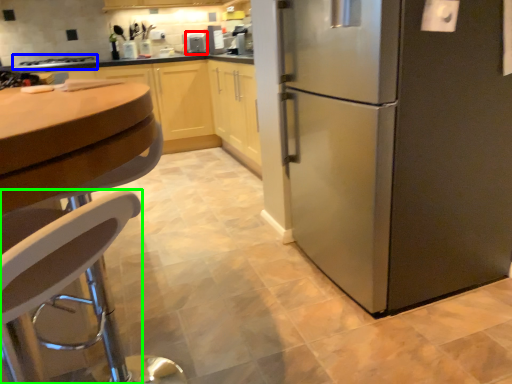
Question: Which is nearer to the appliance (highlighted by a red box)? stove (highlighted by a blue box) or chair (highlighted by a green box).

Choices:
 (A) stove
 (B) chair

Answer: (A)